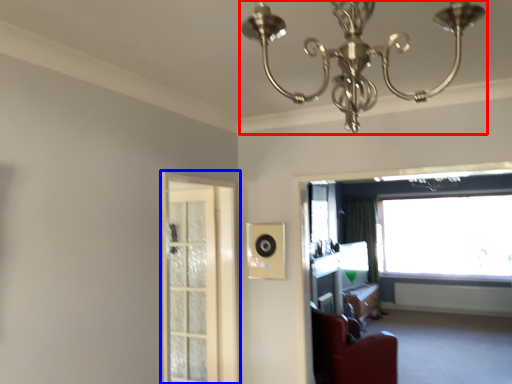
Question: Among these objects, which one is nearest to the camera, lamp (highlighted by a red box) or screen door (highlighted by a blue box)?

Choices:
 (A) lamp
 (B) screen door

Answer: (A)